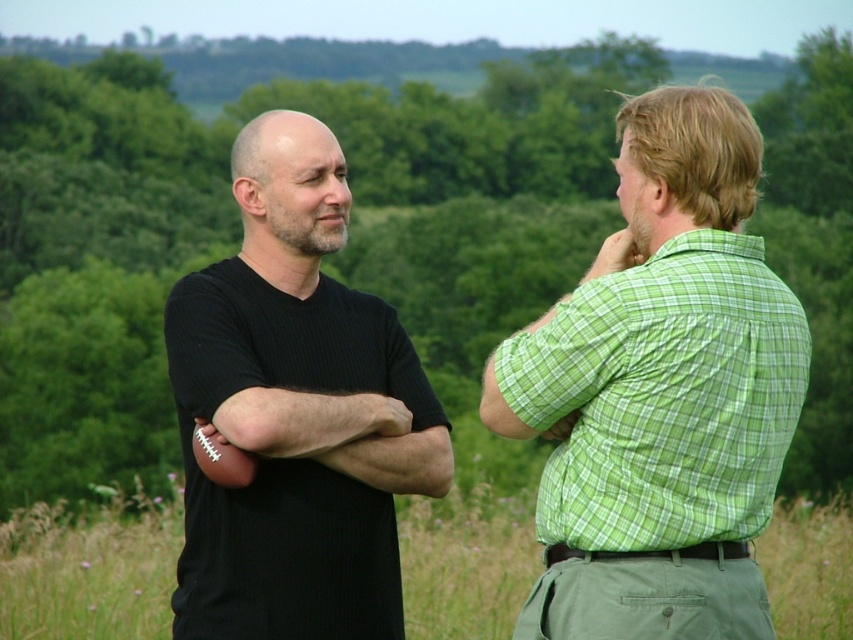
Is green plaid shirt at right below black matte football at left?

Incorrect, green plaid shirt at right is not positioned below black matte football at left.

Which is more to the right, green plaid shirt at right or black matte football at left?

green plaid shirt at right

This screenshot has height=640, width=853. What do you see at coordinates (660, 392) in the screenshot?
I see `green plaid shirt at right` at bounding box center [660, 392].

You are a GUI agent. You are given a task and a screenshot of the screen. Output one action in this format:
    pyautogui.click(x=<x>, y=<y>)
    Task: Click on the green plaid shirt at right
    This screenshot has width=853, height=640.
    Given the screenshot: What is the action you would take?
    pyautogui.click(x=660, y=392)

Does point (718, 429) come in front of point (103, 621)?

Yes, it is.

Does green plaid shirt at right appear over green grass at center?

Yes.

I want to click on green plaid shirt at right, so click(x=660, y=392).

You are a GUI agent. You are given a task and a screenshot of the screen. Output one action in this format:
    pyautogui.click(x=<x>, y=<y>)
    Task: Click on the green plaid shirt at right
    
    Given the screenshot: What is the action you would take?
    point(660,392)

Which of these two, black matte football at left or green grass at center, stands taller?

With more height is black matte football at left.

Between point (363, 426) and point (784, 609), which one is positioned behind?

Positioned behind is point (784, 609).

Identify the location of black matte football at left. Image resolution: width=853 pixels, height=640 pixels. (296, 412).